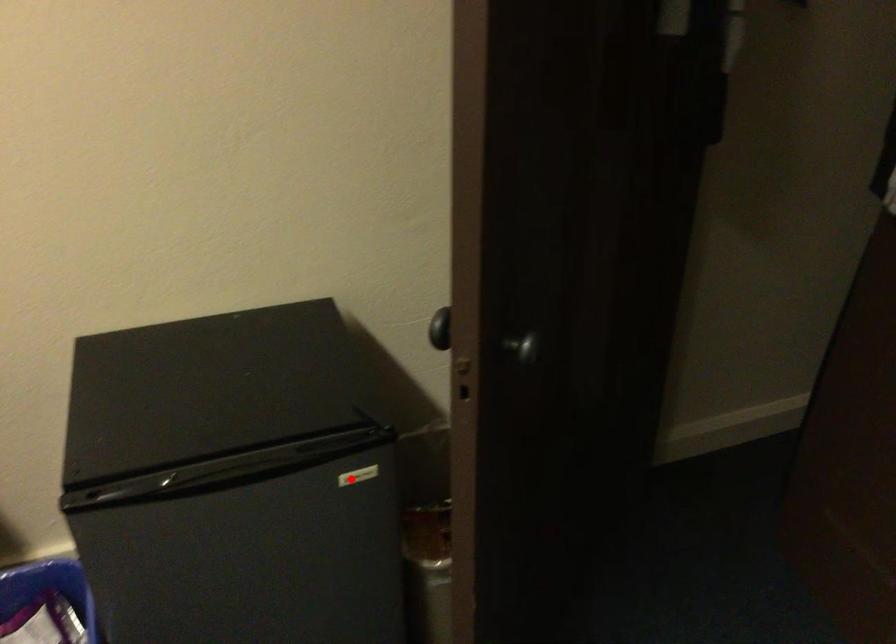
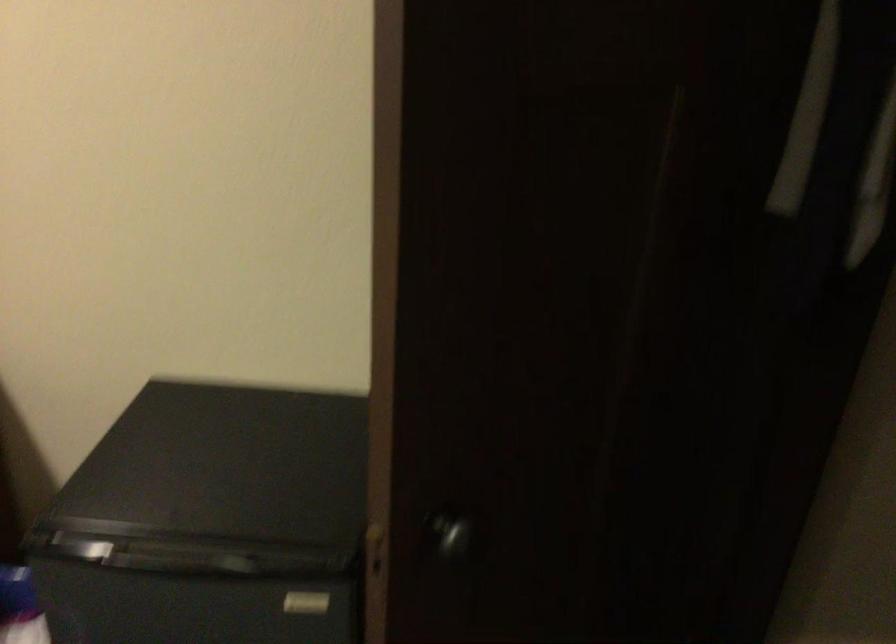
Find the pixel in the second image that matches the highlighted location in the first image.

(306, 603)